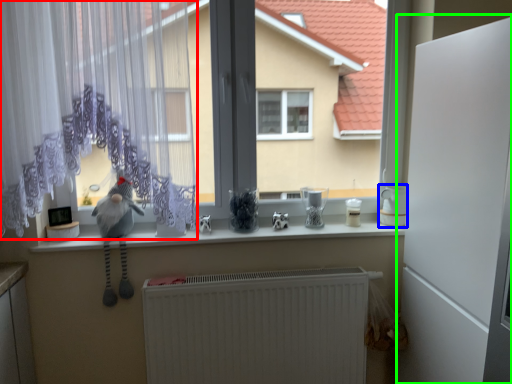
Question: Based on their relative distances, which object is farther from curtain (highlighted by a red box)? Choose from appliance (highlighted by a blue box) and screen door (highlighted by a green box).

Choices:
 (A) appliance
 (B) screen door

Answer: (A)